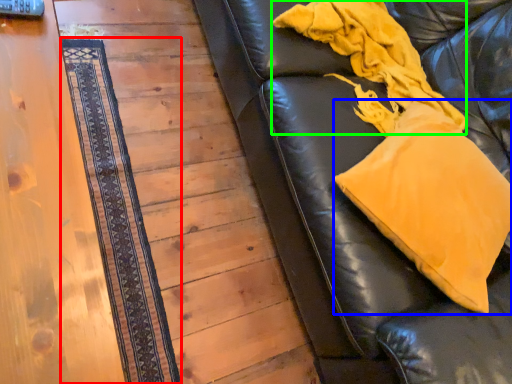
Question: Which is nearer to the mat (highlighted by a red box)? throw pillow (highlighted by a blue box) or blanket (highlighted by a green box).

Choices:
 (A) throw pillow
 (B) blanket

Answer: (B)